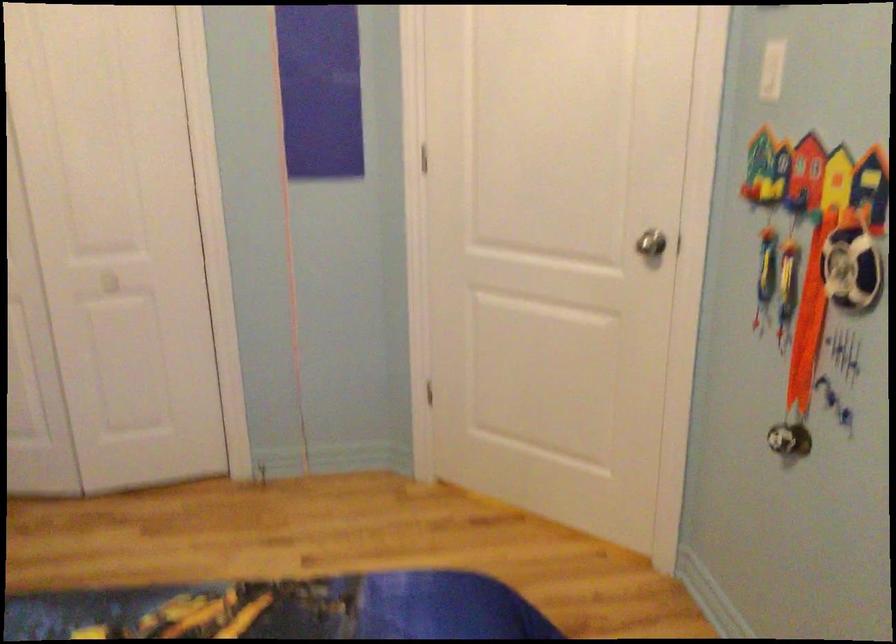
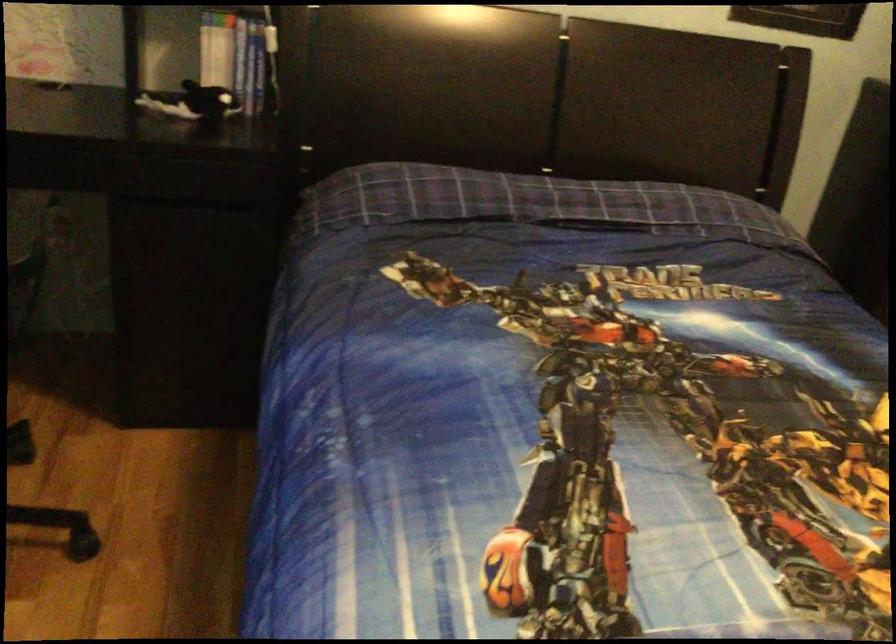
Based on the continuous images, in which direction is the camera rotating?

The camera's rotation is toward left-down.